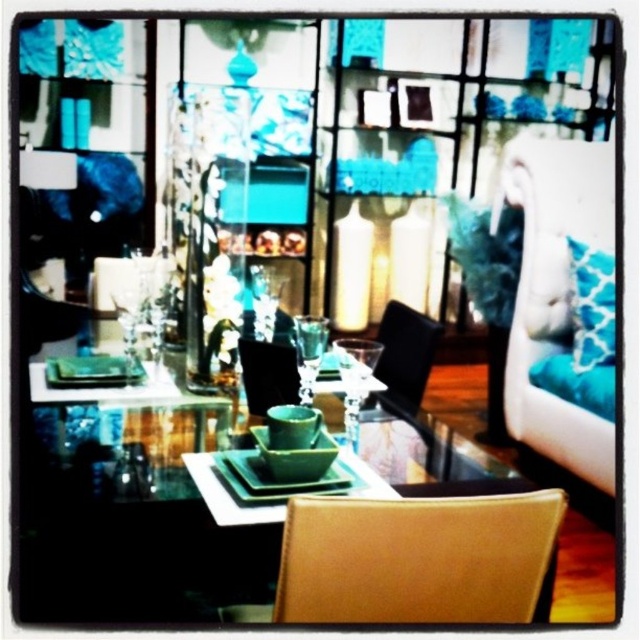
Does green glossy square plate at center have a lesser height compared to black leather chair at center?

No, green glossy square plate at center is not shorter than black leather chair at center.

Is point (140, 420) positioned behind point (416, 401)?

That is False.

Image resolution: width=640 pixels, height=640 pixels. In order to click on green glossy square plate at center in this screenshot , I will do `click(129, 541)`.

Can you confirm if green glossy square plate at center is thinner than leather chair at lower right?

No, green glossy square plate at center is not thinner than leather chair at lower right.

Is green glossy square plate at center taller than leather chair at lower right?

Yes, green glossy square plate at center is taller than leather chair at lower right.

Which is in front, point (136, 436) or point (291, 499)?

Point (291, 499) is more forward.

Where is `green glossy square plate at center`? green glossy square plate at center is located at coordinates (129, 541).

Between green glossy square plate at center and matte black chair at center, which one appears on the right side from the viewer's perspective?

Positioned to the right is matte black chair at center.

Does green glossy square plate at center appear on the left side of matte black chair at center?

Yes, green glossy square plate at center is to the left of matte black chair at center.

Between point (184, 580) and point (253, 362), which one is positioned behind?

The point (253, 362) is behind.

Where is `green glossy square plate at center`? This screenshot has width=640, height=640. green glossy square plate at center is located at coordinates (129, 541).